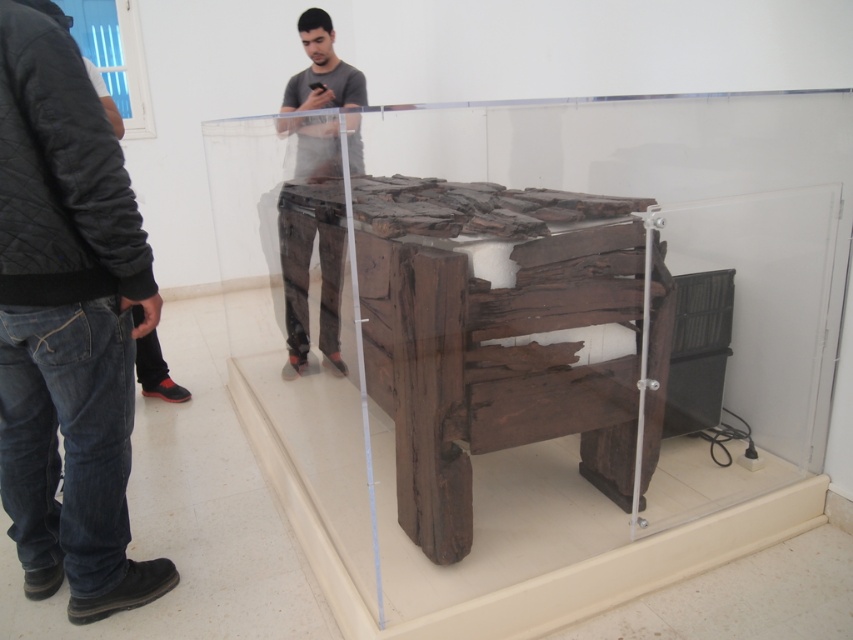
Is dark brown wood at center wider than dark blue jeans at left?

Yes, dark brown wood at center is wider than dark blue jeans at left.

Who is positioned more to the right, dark brown wood at center or dark blue jeans at left?

dark brown wood at center

Is point (395, 272) farther from camera compared to point (57, 337)?

Yes, point (395, 272) is farther from viewer.

Identify the location of dark brown wood at center. (503, 337).

Which of these two, dark blue jeans at left or matte brown pants at center, stands shorter?

dark blue jeans at left is shorter.

Is dark blue jeans at left to the right of matte brown pants at center from the viewer's perspective?

Incorrect, dark blue jeans at left is not on the right side of matte brown pants at center.

Does point (132, 268) lie behind point (289, 330)?

No, it is in front of (289, 330).

Where is `dark blue jeans at left`? This screenshot has height=640, width=853. dark blue jeans at left is located at coordinates tap(67, 324).

In order to click on dark brown wood at center in this screenshot , I will do `click(503, 337)`.

Between dark brown wood at center and matte brown pants at center, which one has more height?

matte brown pants at center is taller.

Who is more forward, (412, 296) or (314, 54)?

Point (412, 296) is more forward.

At what (x,y) coordinates should I click in order to perform the action: click on dark brown wood at center. Please return your answer as a coordinate pair (x, y). The image size is (853, 640). Looking at the image, I should click on (503, 337).